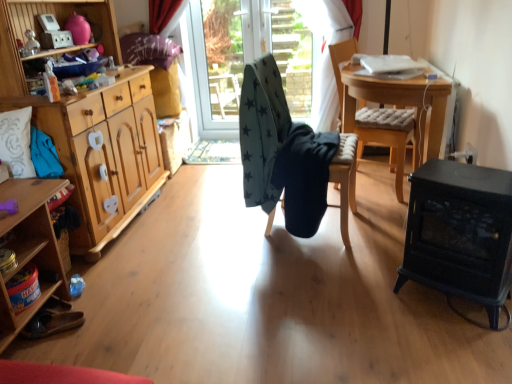
What are the coordinates of `free point in front of brown leather shoes at lower left` in the screenshot? It's located at (52, 350).